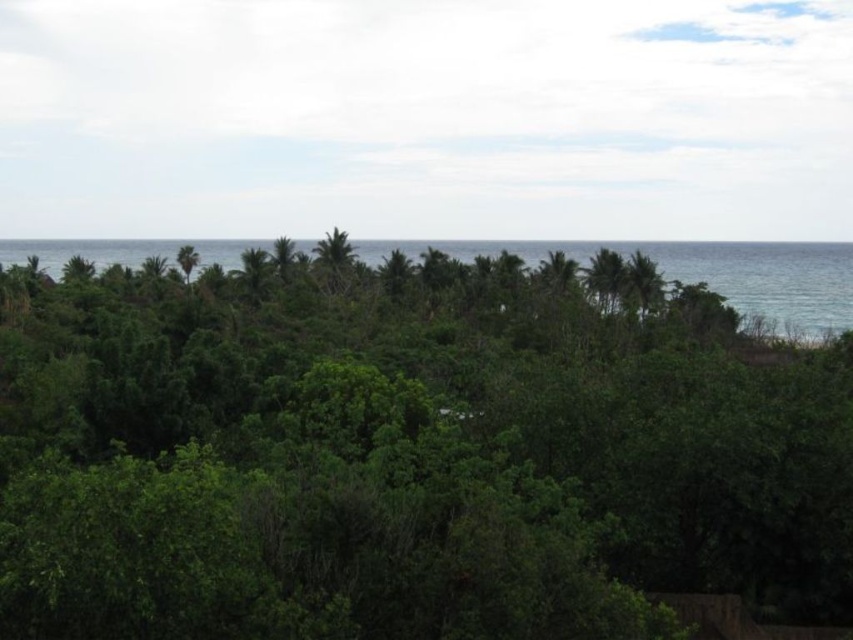
Does green leafy tree at center have a lesser height compared to green leafy tree at left?

Incorrect, green leafy tree at center's height does not fall short of green leafy tree at left's.

Describe the element at coordinates (405, 452) in the screenshot. I see `green leafy tree at center` at that location.

Identify the location of green leafy tree at center. The image size is (853, 640). (405, 452).

In the scene shown: Can you confirm if green leafy tree at center is taller than green leafy tree at upper right?

Yes, green leafy tree at center is taller than green leafy tree at upper right.

Which is in front, point (170, 616) or point (648, 280)?

Positioned in front is point (170, 616).

This screenshot has height=640, width=853. What do you see at coordinates (405, 452) in the screenshot? I see `green leafy tree at center` at bounding box center [405, 452].

I want to click on green leafy tree at center, so click(405, 452).

Between green leafy tree at center and blue water at upper center, which one appears on the right side from the viewer's perspective?

blue water at upper center

Which is below, green leafy tree at center or blue water at upper center?

green leafy tree at center is lower down.

Who is more distant from viewer, [317,408] or [213,243]?

Point [213,243]

This screenshot has width=853, height=640. Find the location of `green leafy tree at center`. green leafy tree at center is located at coordinates (405, 452).